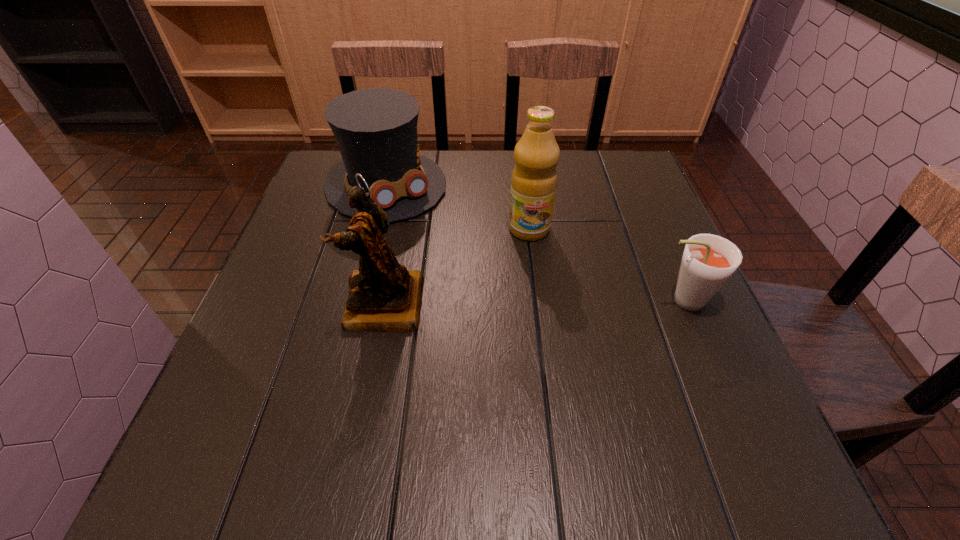
This screenshot has height=540, width=960. What are the coordinates of `figurine` in the screenshot? It's located at (384, 296).

Locate an element on the screen. Image resolution: width=960 pixels, height=540 pixels. the rightmost object is located at coordinates (708, 261).

This screenshot has height=540, width=960. Identify the location of the shortest object. (708, 261).

Locate an element on the screen. Image resolution: width=960 pixels, height=540 pixels. olive oil is located at coordinates (534, 178).

Where is `the third tallest object`? Image resolution: width=960 pixels, height=540 pixels. the third tallest object is located at coordinates (376, 129).

Find the location of a particular element. vacant area located on the front-facing side of the figurine is located at coordinates pos(278,305).

At what (x,y) coordinates should I click in order to perform the action: click on free location located 0.240m on the drink side of the root beer. Please return your answer as a coordinate pair (x, y). Image resolution: width=960 pixels, height=540 pixels. Looking at the image, I should click on (533, 300).

Find the location of a particular element. free spot located on the drink side of the root beer is located at coordinates (517, 300).

Find the location of `vacant region located 0.050m on the drink side of the root beer`. vacant region located 0.050m on the drink side of the root beer is located at coordinates (626, 300).

Identify the location of vacant space located on the label of the olive oil. Image resolution: width=960 pixels, height=540 pixels. (561, 395).